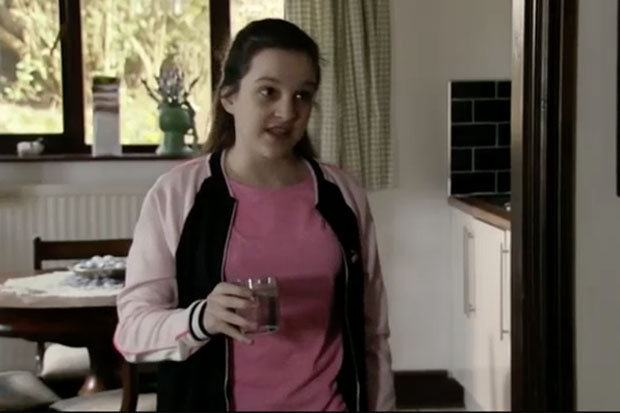
Image resolution: width=620 pixels, height=413 pixels. What are the coordinates of `glass` in the screenshot? It's located at (271, 299).